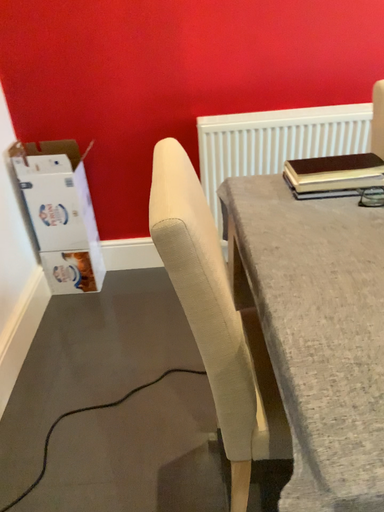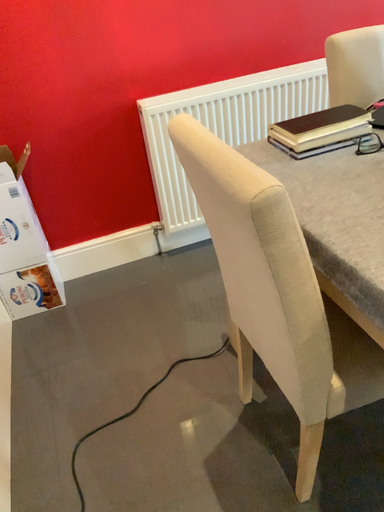
Question: Which way did the camera rotate in the video?

Choices:
 (A) rotated left
 (B) rotated right

Answer: (B)